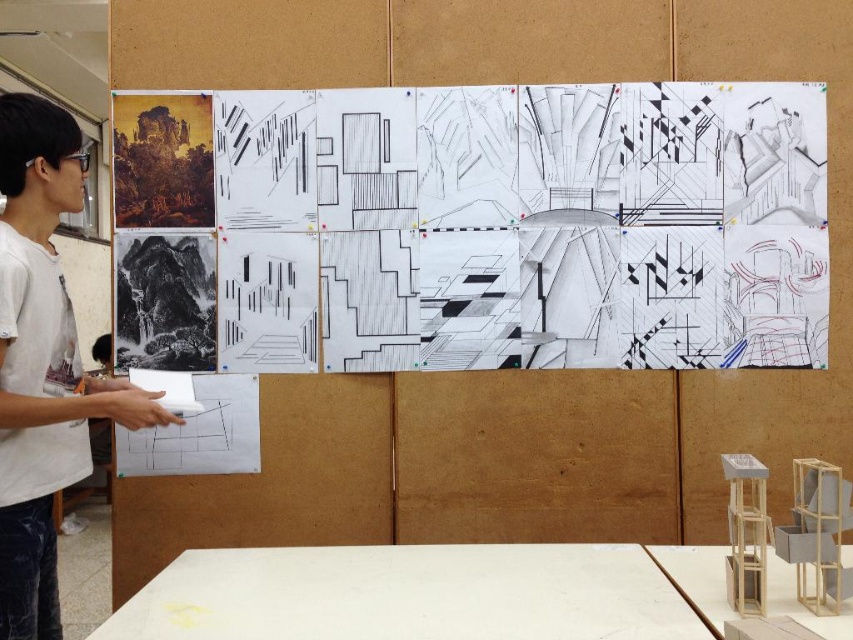
You are standing in front of the display wall and want to reach the white paper at upper center to make a note. If your arm can extend 1.5 meters, can you reach it?

The white paper at upper center is 2.86 meters from viewer, which is beyond your arm extension of 1.5 meters. You cannot reach it.